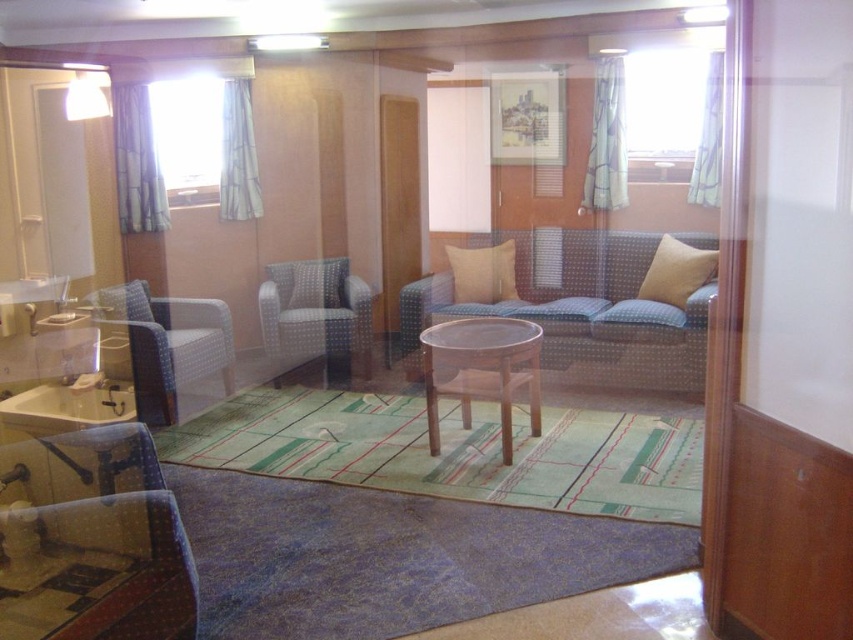
You are standing at the entrance of the cabin and want to place a new beige fabric pillow at center. According to the coordinates provided, where should you place it?

You should place the beige fabric pillow at center at the coordinates point [482,273].

You are a guest staying in this cabin and need to place a rectangular box that measures 40 centimeters in length between the matte blue armchair at left and the white glossy sink at lower left. Is there enough space to fit the box without moving either object?

The distance between the matte blue armchair at left and the white glossy sink at lower left is 38.39 centimeters. Since the box is 40 centimeters long, it would not fit between them as the space is slightly shorter than the box.